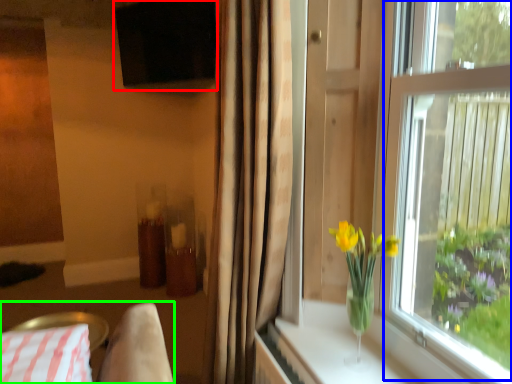
Question: Which object is the closest to the window screen (highlighted by a red box)? Choose among these: window screen (highlighted by a blue box) or bedding (highlighted by a green box).

Choices:
 (A) window screen
 (B) bedding

Answer: (A)